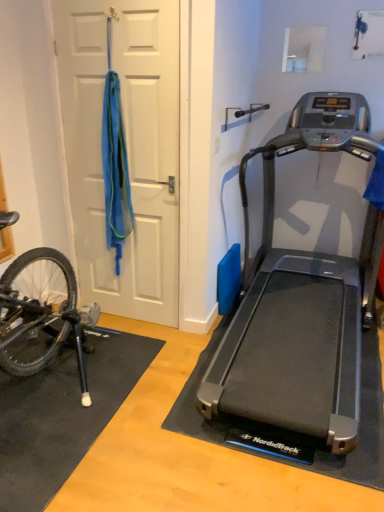
Question: Is black matte bicycle at lower left taller or shorter than silver metallic treadmill at right?

Choices:
 (A) short
 (B) tall

Answer: (A)

Question: Do you think black matte bicycle at lower left is within silver metallic treadmill at right, or outside of it?

Choices:
 (A) outside
 (B) inside

Answer: (A)

Question: Which object is positioned farthest from the black matte bicycle at lower left?

Choices:
 (A) white matte door at left
 (B) black rubber doormat at lower left
 (C) silver metallic treadmill at right

Answer: (C)

Question: Estimate the real-world distances between objects in this image. Which object is closer to the black rubber doormat at lower left?

Choices:
 (A) silver metallic treadmill at right
 (B) white matte door at left
 (C) black matte bicycle at lower left

Answer: (C)